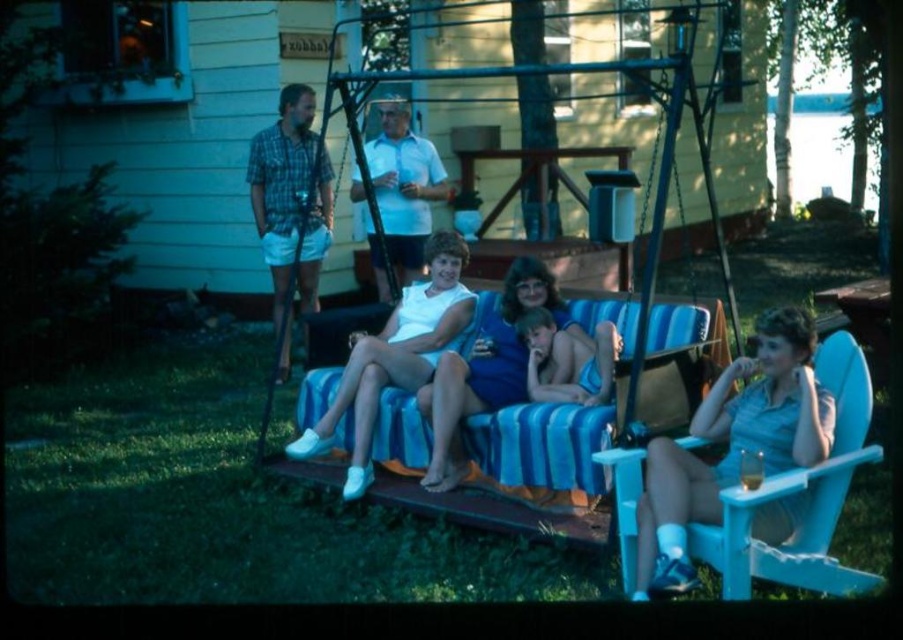
Question: Which of the following is the closest to the observer?

Choices:
 (A) (548, 428)
 (B) (522, 333)
 (C) (355, 177)

Answer: (A)

Question: Is light blue plastic chair at right positioned at the back of blue fabric shorts at center?

Choices:
 (A) yes
 (B) no

Answer: (B)

Question: Among these objects, which one is farthest from the camera?

Choices:
 (A) blue fabric shorts at center
 (B) blue striped cushion at center
 (C) white matte swimsuit at center
 (D) plaid shirt at left

Answer: (D)

Question: Does light blue plastic chair at right appear on the left side of white cotton shirt at center?

Choices:
 (A) yes
 (B) no

Answer: (B)

Question: Which of the following is the closest to the observer?

Choices:
 (A) white matte swimsuit at center
 (B) matte blue dress at center
 (C) blue fabric shorts at center

Answer: (C)

Question: Is light blue plastic chair at right bigger than white cotton shirt at center?

Choices:
 (A) no
 (B) yes

Answer: (A)